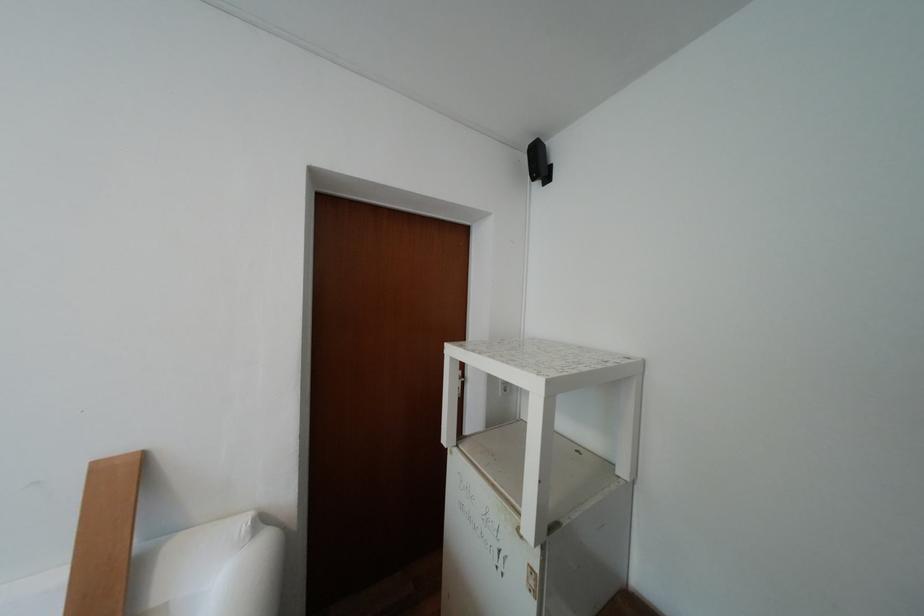
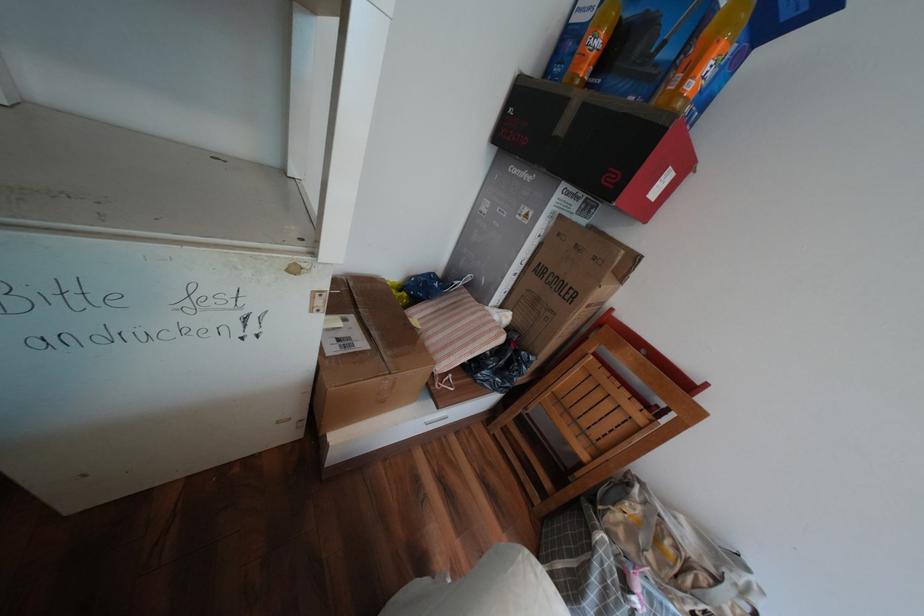
First-person continuous shooting, in which direction is the camera rotating?

The camera's rotation is toward right-down.